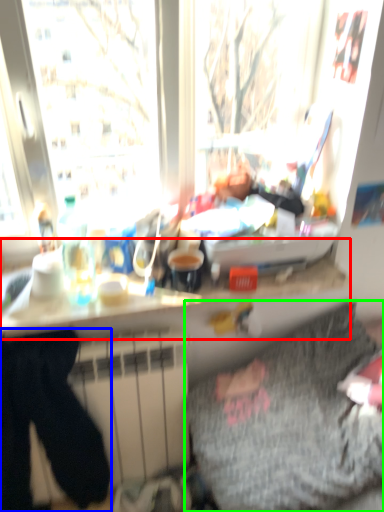
Question: Estimate the real-world distances between objects in this image. Which object is closer to counter top (highlighted by a red box), sweat pant (highlighted by a blue box) or bedding (highlighted by a green box)?

Choices:
 (A) sweat pant
 (B) bedding

Answer: (A)